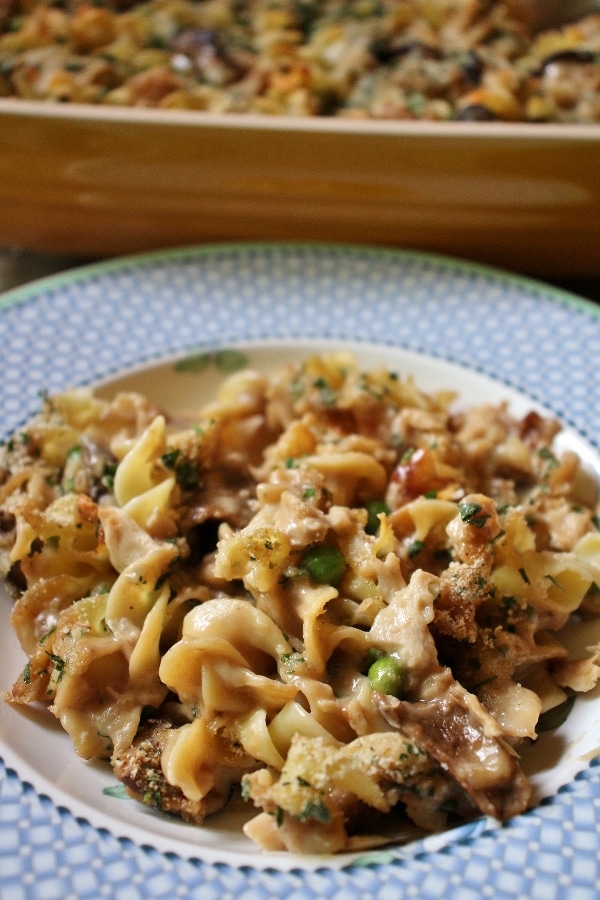
Locate an element on the screen. The height and width of the screenshot is (900, 600). dark blue dots painted on bowl edge is located at coordinates (102, 832), (83, 822), (60, 810), (39, 796), (590, 762), (583, 772), (564, 788), (436, 849), (397, 862), (298, 868).